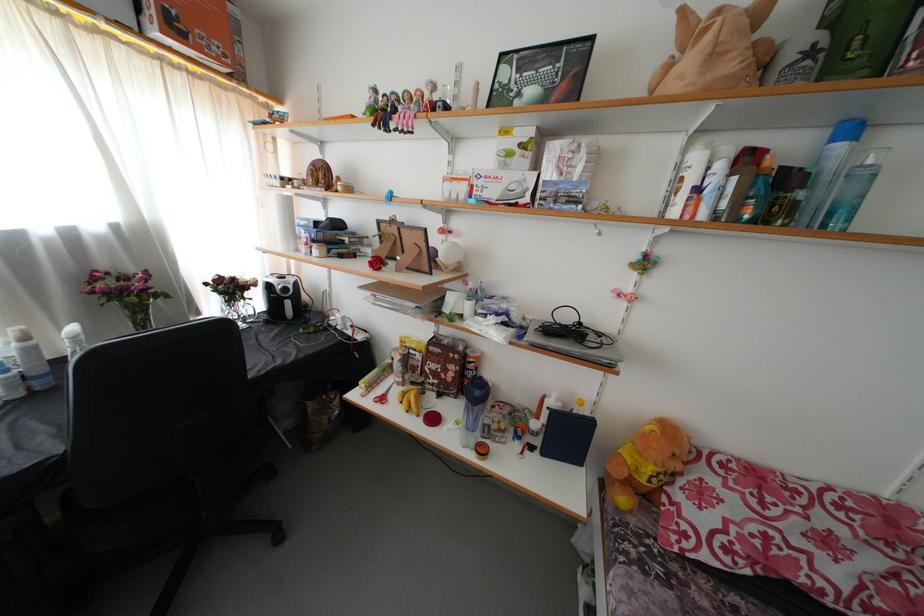
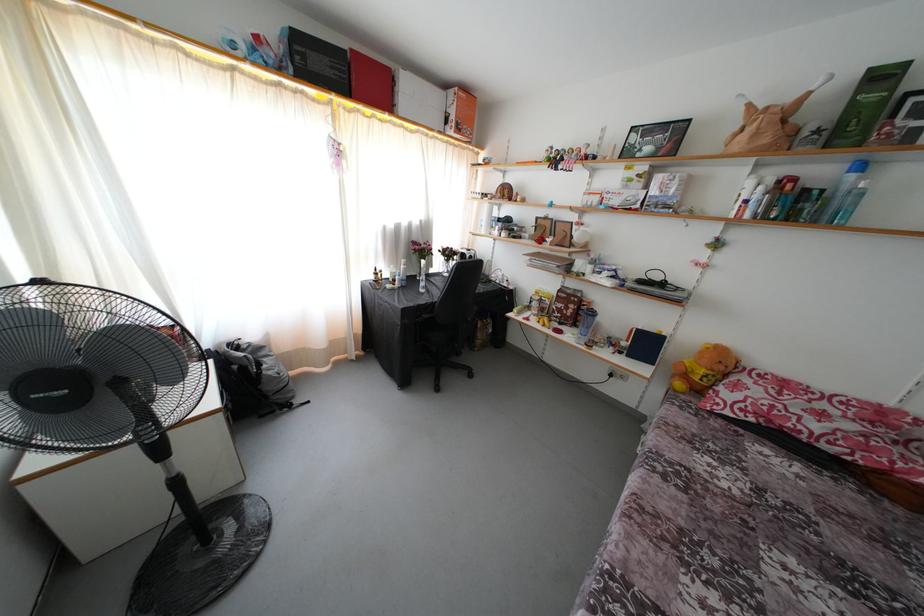
Find the pixel in the second image that matches point (684, 472) in the first image.

(726, 373)